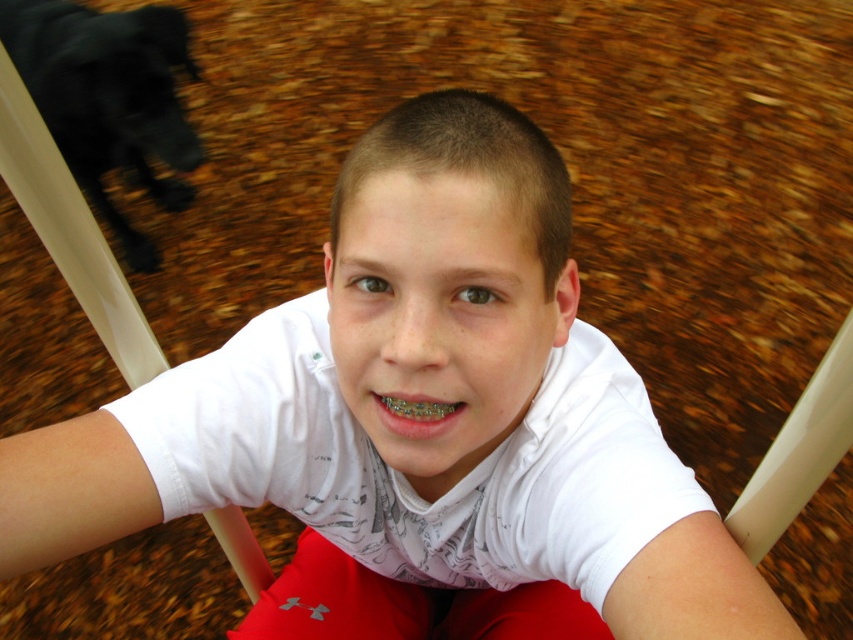
At what (x,y) coordinates should I click in order to perform the action: click on black fur dog at upper left. Please return your answer as a coordinate pair (x, y). The image size is (853, 640). Looking at the image, I should click on pos(109,99).

How distant is black fur dog at upper left from metallic silver braces at center?

black fur dog at upper left and metallic silver braces at center are 6.93 feet apart.

Locate an element on the screen. This screenshot has width=853, height=640. black fur dog at upper left is located at coordinates (109, 99).

Between point (152, 429) and point (140, 44), which one is positioned behind?

Point (140, 44)

Can you confirm if white cotton shirt at center is positioned below black fur dog at upper left?

Correct, white cotton shirt at center is located below black fur dog at upper left.

Who is more forward, (660, 465) or (107, 218)?

Point (660, 465) is more forward.

Locate an element on the screen. white cotton shirt at center is located at coordinates (403, 476).

Where is `white cotton shirt at center`? The height and width of the screenshot is (640, 853). white cotton shirt at center is located at coordinates (403, 476).

Is white cotton shirt at center to the left of metallic silver braces at center from the viewer's perspective?

No, white cotton shirt at center is not to the left of metallic silver braces at center.

You are a GUI agent. You are given a task and a screenshot of the screen. Output one action in this format:
    pyautogui.click(x=<x>, y=<y>)
    Task: Click on the white cotton shirt at center
    The width and height of the screenshot is (853, 640).
    Given the screenshot: What is the action you would take?
    (403, 476)

Identify the location of white cotton shirt at center. (403, 476).